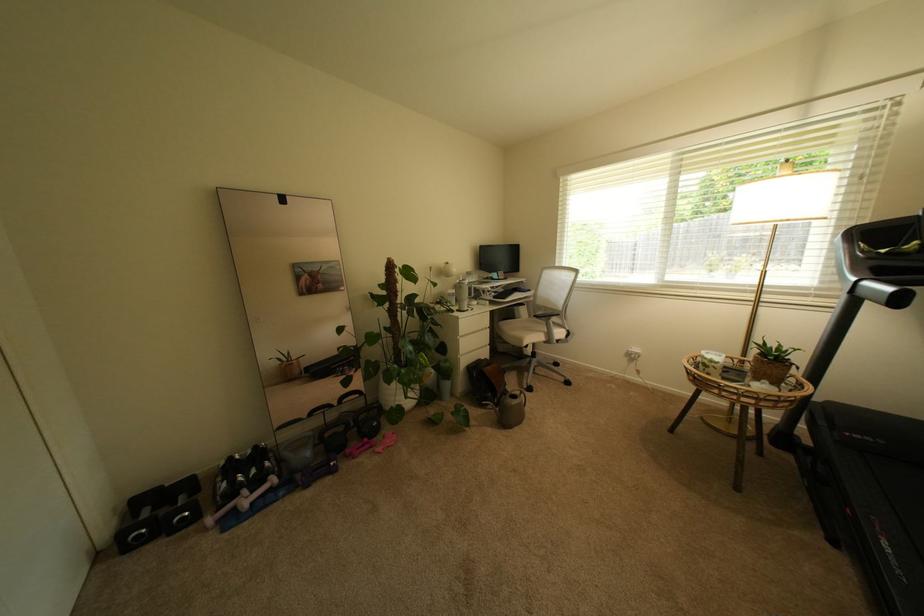
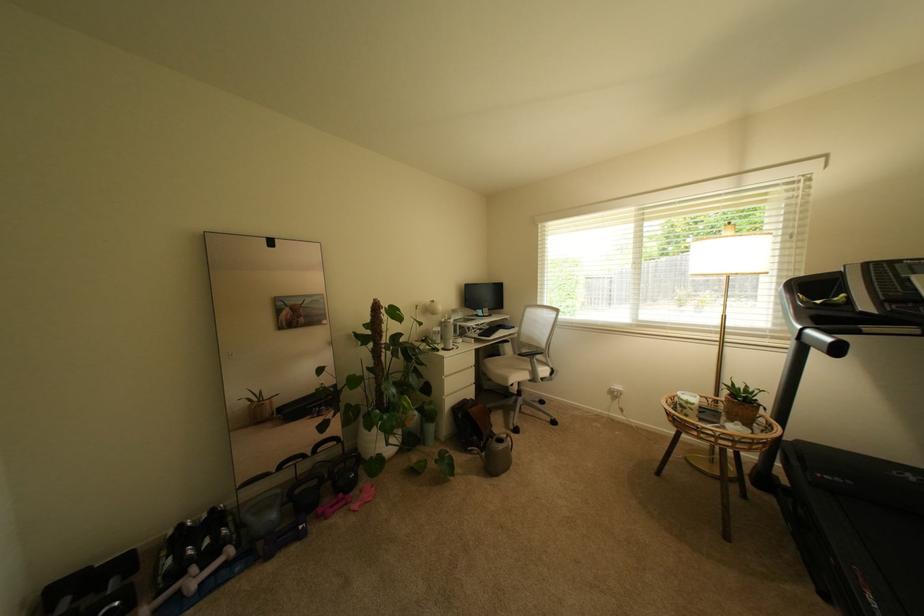
In the second image, find the point that corresponds to (196,515) in the first image.

(126, 604)